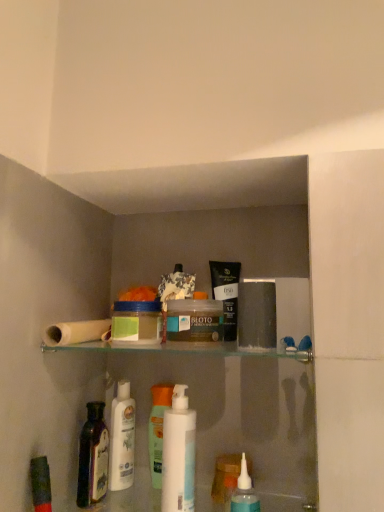
Describe the element at coordinates (178, 454) in the screenshot. The height and width of the screenshot is (512, 384). I see `white plastic bottle at center, placed as the third mouthwash when sorted from top to bottom` at that location.

Where is `translucent plastic bottle at center, which appears as the second toiletry when viewed from the left`? Image resolution: width=384 pixels, height=512 pixels. translucent plastic bottle at center, which appears as the second toiletry when viewed from the left is located at coordinates (158, 429).

In order to face matte black tube at upper center, placed as the 1th toiletry when sorted from right to left, should I rotate leftwards or rightwards?

Turn right by 8.239 degrees to look at matte black tube at upper center, placed as the 1th toiletry when sorted from right to left.

The width and height of the screenshot is (384, 512). Find the location of `white plastic bottle at center, marked as the first mouthwash in a bottom-to-top arrangement`. white plastic bottle at center, marked as the first mouthwash in a bottom-to-top arrangement is located at coordinates (178, 454).

Are clear plastic bottle at lower center, which is counted as the third toiletry, starting from the left, and translucent plastic bottle at center, positioned as the 3th toiletry in right-to-left order, making contact?

clear plastic bottle at lower center, which is counted as the third toiletry, starting from the left, and translucent plastic bottle at center, positioned as the 3th toiletry in right-to-left order, are not in contact.

Considering the relative sizes of clear plastic bottle at lower center, which is counted as the third toiletry, starting from the left, and translucent plastic bottle at center, positioned as the 3th toiletry in right-to-left order, in the image provided, is clear plastic bottle at lower center, which is counted as the third toiletry, starting from the left, shorter than translucent plastic bottle at center, positioned as the 3th toiletry in right-to-left order,?

Yes.

What's the angular difference between clear plastic bottle at lower center, which is counted as the third toiletry, starting from the left, and translucent plastic bottle at center, positioned as the 3th toiletry in right-to-left order,'s facing directions?

There is a 0.00265-degree angle between the facing directions of clear plastic bottle at lower center, which is counted as the third toiletry, starting from the left, and translucent plastic bottle at center, positioned as the 3th toiletry in right-to-left order.

Who is taller, dark purple glass bottle at lower left or white plastic bottle at center, placed as the third mouthwash when sorted from top to bottom?

With more height is white plastic bottle at center, placed as the third mouthwash when sorted from top to bottom.

Does dark purple glass bottle at lower left lie behind white plastic bottle at center, placed as the third mouthwash when sorted from top to bottom?

Yes.

Can you confirm if dark purple glass bottle at lower left is thinner than white plastic bottle at center, placed as the third mouthwash when sorted from top to bottom?

Incorrect, the width of dark purple glass bottle at lower left is not less than that of white plastic bottle at center, placed as the third mouthwash when sorted from top to bottom.

Who is smaller, matte black tube at upper center, the 4th toiletry positioned from the left, or clear plastic bottle at lower center, the 2th toiletry from the right?

clear plastic bottle at lower center, the 2th toiletry from the right, is smaller.

Is point (242, 298) positioned behind point (237, 508)?

No, it is not.

Between matte black tube at upper center, the 4th toiletry positioned from the left, and clear plastic bottle at lower center, which is counted as the third toiletry, starting from the left, which one is positioned in front?

Positioned in front is clear plastic bottle at lower center, which is counted as the third toiletry, starting from the left.

From a real-world perspective, is matte black tube at upper center, the 4th toiletry positioned from the left, positioned over clear plastic bottle at lower center, which is counted as the third toiletry, starting from the left, based on gravity?

Correct, in the physical world, matte black tube at upper center, the 4th toiletry positioned from the left, is higher than clear plastic bottle at lower center, which is counted as the third toiletry, starting from the left.

Is translucent plastic bottle at center, which appears as the second toiletry when viewed from the left, oriented towards translucent plastic container at center, the 1th mouthwash in the top-to-bottom sequence?

No, translucent plastic bottle at center, which appears as the second toiletry when viewed from the left, does not turn towards translucent plastic container at center, the 1th mouthwash in the top-to-bottom sequence.

From the image's perspective, is translucent plastic bottle at center, positioned as the 3th toiletry in right-to-left order, below translucent plastic container at center, positioned as the third mouthwash in bottom-to-top order?

Indeed, from the image's perspective, translucent plastic bottle at center, positioned as the 3th toiletry in right-to-left order, is shown beneath translucent plastic container at center, positioned as the third mouthwash in bottom-to-top order.

From the image's perspective, starting from the translucent plastic container at center, positioned as the third mouthwash in bottom-to-top order, which toiletry is the 1st one below? Please provide its 2D coordinates.

[(158, 429)]

Consider the image. Is translucent plastic bottle at center, positioned as the 3th toiletry in right-to-left order, directly adjacent to translucent plastic container at center, the 1th mouthwash in the top-to-bottom sequence?

No, translucent plastic bottle at center, positioned as the 3th toiletry in right-to-left order, is not beside translucent plastic container at center, the 1th mouthwash in the top-to-bottom sequence.

Does translucent plastic container at center, positioned as the third mouthwash in bottom-to-top order, touch translucent plastic jar at center, the 2th mouthwash from the bottom?

Yes, translucent plastic container at center, positioned as the third mouthwash in bottom-to-top order, is in contact with translucent plastic jar at center, the 2th mouthwash from the bottom.

Does translucent plastic container at center, positioned as the third mouthwash in bottom-to-top order, appear on the right side of translucent plastic jar at center, the 2th mouthwash from the bottom?

In fact, translucent plastic container at center, positioned as the third mouthwash in bottom-to-top order, is to the left of translucent plastic jar at center, the 2th mouthwash from the bottom.

Does white plastic bottle at center, which is the fourth toiletry in right-to-left order, have a larger size compared to dark purple glass bottle at lower left?

Yes, white plastic bottle at center, which is the fourth toiletry in right-to-left order, is bigger than dark purple glass bottle at lower left.

From their relative heights in the image, would you say white plastic bottle at center, the first toiletry positioned from the left, is taller or shorter than dark purple glass bottle at lower left?

white plastic bottle at center, the first toiletry positioned from the left, is taller than dark purple glass bottle at lower left.

From a real-world perspective, is white plastic bottle at center, which is the fourth toiletry in right-to-left order, physically above dark purple glass bottle at lower left?

Yes.

Does white plastic bottle at center, the first toiletry positioned from the left, have a lesser width compared to dark purple glass bottle at lower left?

No.

From the image's perspective, is translucent plastic jar at center, which is the second mouthwash in top-to-bottom order, positioned above or below matte black tube at upper center, placed as the 1th toiletry when sorted from right to left?

Based on their image positions, translucent plastic jar at center, which is the second mouthwash in top-to-bottom order, is located beneath matte black tube at upper center, placed as the 1th toiletry when sorted from right to left.

Find the location of a particular element. This screenshot has width=384, height=512. toiletry that is the 1st one when counting forward from the translucent plastic jar at center, the 2th mouthwash from the bottom is located at coordinates (257, 314).

From the picture: How different are the orientations of translucent plastic jar at center, which is the second mouthwash in top-to-bottom order, and matte black tube at upper center, placed as the 1th toiletry when sorted from right to left, in degrees?

The angular difference between translucent plastic jar at center, which is the second mouthwash in top-to-bottom order, and matte black tube at upper center, placed as the 1th toiletry when sorted from right to left, is 0.000528 degrees.

Is translucent plastic jar at center, the 2th mouthwash from the bottom, not close to matte black tube at upper center, placed as the 1th toiletry when sorted from right to left?

translucent plastic jar at center, the 2th mouthwash from the bottom, is near matte black tube at upper center, placed as the 1th toiletry when sorted from right to left, not far away.

Where is `the 2nd toiletry in front when counting from the translucent plastic bottle at center, positioned as the 3th toiletry in right-to-left order`? Image resolution: width=384 pixels, height=512 pixels. the 2nd toiletry in front when counting from the translucent plastic bottle at center, positioned as the 3th toiletry in right-to-left order is located at coordinates (244, 492).

From the image's perspective, starting from the dark purple glass bottle at lower left, which mouthwash is the 1st one above? Please provide its 2D coordinates.

[(178, 454)]

Consider the image. When comparing their distances from white plastic bottle at center, placed as the third mouthwash when sorted from top to bottom, does translucent plastic jar at center, the 2th mouthwash from the bottom, or dark purple glass bottle at lower left seem further?

The object further to white plastic bottle at center, placed as the third mouthwash when sorted from top to bottom, is translucent plastic jar at center, the 2th mouthwash from the bottom.

When comparing their distances from matte black tube at upper center, the 4th toiletry positioned from the left, does clear plastic bottle at lower center, the 2th toiletry from the right, or translucent plastic jar at center, which is the second mouthwash in top-to-bottom order, seem closer?

translucent plastic jar at center, which is the second mouthwash in top-to-bottom order, is positioned closer to the anchor matte black tube at upper center, the 4th toiletry positioned from the left.

Looking at the image, which one is located closer to white matte toilet paper at upper left, white plastic bottle at center, marked as the first mouthwash in a bottom-to-top arrangement, or matte black tube at upper center, placed as the 1th toiletry when sorted from right to left?

Based on the image, white plastic bottle at center, marked as the first mouthwash in a bottom-to-top arrangement, appears to be nearer to white matte toilet paper at upper left.

Considering their positions, is clear plastic bottle at lower center, which is counted as the third toiletry, starting from the left, positioned closer to translucent plastic container at center, the 1th mouthwash in the top-to-bottom sequence, than white matte toilet paper at upper left?

Among the two, white matte toilet paper at upper left is located nearer to translucent plastic container at center, the 1th mouthwash in the top-to-bottom sequence.

Which object lies further to the anchor point translucent plastic bottle at center, positioned as the 3th toiletry in right-to-left order, white plastic bottle at center, the first toiletry positioned from the left, or translucent plastic container at center, positioned as the third mouthwash in bottom-to-top order?

translucent plastic container at center, positioned as the third mouthwash in bottom-to-top order, is positioned further to the anchor translucent plastic bottle at center, positioned as the 3th toiletry in right-to-left order.

Estimate the real-world distances between objects in this image. Which object is further from translucent plastic container at center, the 1th mouthwash in the top-to-bottom sequence, white plastic bottle at center, placed as the third mouthwash when sorted from top to bottom, or translucent plastic bottle at center, which appears as the second toiletry when viewed from the left?

translucent plastic bottle at center, which appears as the second toiletry when viewed from the left, is further to translucent plastic container at center, the 1th mouthwash in the top-to-bottom sequence.

Estimate the real-world distances between objects in this image. Which object is further from white plastic bottle at center, which is the fourth toiletry in right-to-left order, translucent plastic bottle at center, which appears as the second toiletry when viewed from the left, or dark purple glass bottle at lower left?

Based on the image, translucent plastic bottle at center, which appears as the second toiletry when viewed from the left, appears to be further to white plastic bottle at center, which is the fourth toiletry in right-to-left order.

Which object lies further to the anchor point clear plastic bottle at lower center, the 2th toiletry from the right, white matte toilet paper at upper left or translucent plastic jar at center, which is the second mouthwash in top-to-bottom order?

white matte toilet paper at upper left is positioned further to the anchor clear plastic bottle at lower center, the 2th toiletry from the right.

Image resolution: width=384 pixels, height=512 pixels. Identify the location of toiletry between translucent plastic jar at center, which is the second mouthwash in top-to-bottom order, and white plastic bottle at center, the first toiletry positioned from the left, in the up-down direction. (158, 429).

This screenshot has width=384, height=512. Find the location of `toilet paper between translucent plastic container at center, positioned as the third mouthwash in bottom-to-top order, and translucent plastic bottle at center, which appears as the second toiletry when viewed from the left, from top to bottom`. toilet paper between translucent plastic container at center, positioned as the third mouthwash in bottom-to-top order, and translucent plastic bottle at center, which appears as the second toiletry when viewed from the left, from top to bottom is located at coordinates pos(77,332).

Where is `mouthwash between translucent plastic jar at center, the 2th mouthwash from the bottom, and clear plastic bottle at lower center, the 2th toiletry from the right, from top to bottom`? The image size is (384, 512). mouthwash between translucent plastic jar at center, the 2th mouthwash from the bottom, and clear plastic bottle at lower center, the 2th toiletry from the right, from top to bottom is located at coordinates (178, 454).

Where is `toilet paper between translucent plastic container at center, the 1th mouthwash in the top-to-bottom sequence, and white plastic bottle at center, the first toiletry positioned from the left, in the vertical direction`? The height and width of the screenshot is (512, 384). toilet paper between translucent plastic container at center, the 1th mouthwash in the top-to-bottom sequence, and white plastic bottle at center, the first toiletry positioned from the left, in the vertical direction is located at coordinates (x=77, y=332).